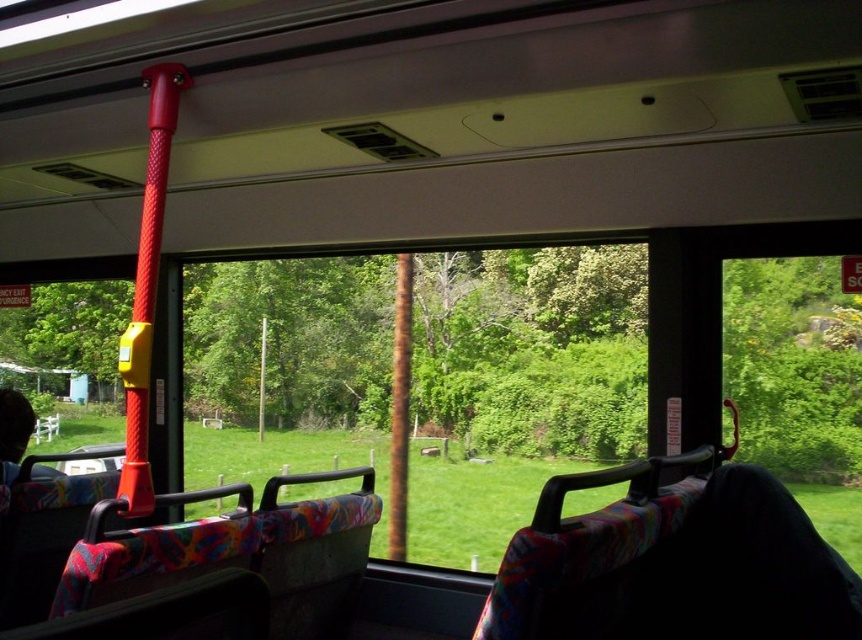
You are a passenger on the bus and you notice the green leafy tree at left and the rusty metal pole at center outside the window. Which object appears taller from your viewpoint inside the bus?

The green leafy tree at left appears taller than the rusty metal pole at center from your viewpoint inside the bus.

You are a passenger sitting in the bus and looking through the window. You notice two points outside the window at coordinates point (8, 340) and point (403, 378). Which point is closer to you?

Point (8, 340) is further to the viewer than point (403, 378), so the point closer to you is point (403, 378).